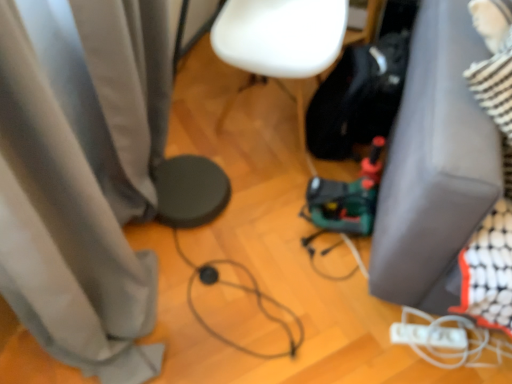
Question: Based on their positions, is white matte chair at center located to the left or right of black cable at center?

Choices:
 (A) right
 (B) left

Answer: (A)

Question: Considering the positions of white matte chair at center and black cable at center in the image, is white matte chair at center wider or thinner than black cable at center?

Choices:
 (A) thin
 (B) wide

Answer: (B)

Question: Which object is positioned farthest from the black cable at center?

Choices:
 (A) white matte wii controller at lower right
 (B) white matte chair at center
 (C) gray fabric couch at lower right

Answer: (B)

Question: Estimate the real-world distances between objects in this image. Which object is farther from the white matte wii controller at lower right?

Choices:
 (A) white matte chair at center
 (B) black cable at center
 (C) gray fabric couch at lower right

Answer: (A)